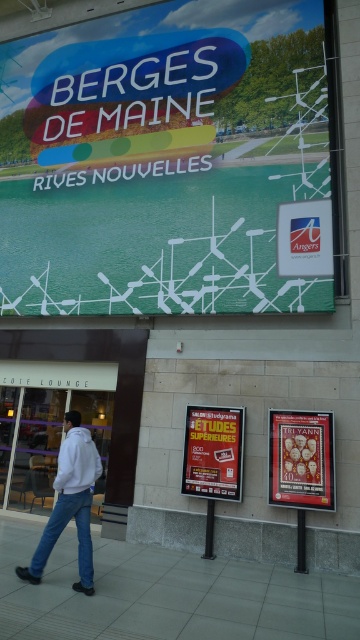
Question: Is matte white oars at upper center wider than denim at lower left?

Choices:
 (A) yes
 (B) no

Answer: (A)

Question: From the image, what is the correct spatial relationship of gray tile pavement at lower center in relation to denim at lower left?

Choices:
 (A) left
 (B) right

Answer: (B)

Question: Which object appears farthest from the camera in this image?

Choices:
 (A) metallic gold poster at center
 (B) matte black poster at center
 (C) white fleece jacket at lower left
 (D) denim at lower left

Answer: (B)

Question: Which of the following is the farthest from the observer?

Choices:
 (A) (75, 588)
 (B) (64, 419)
 (C) (257, 212)
 (D) (294, 458)

Answer: (B)

Question: Does matte white oars at upper center have a lesser width compared to denim at lower left?

Choices:
 (A) no
 (B) yes

Answer: (A)

Question: Which point is farther to the camera?

Choices:
 (A) (56, 616)
 (B) (82, 428)
 (C) (232, 448)
 (D) (88, 545)

Answer: (C)